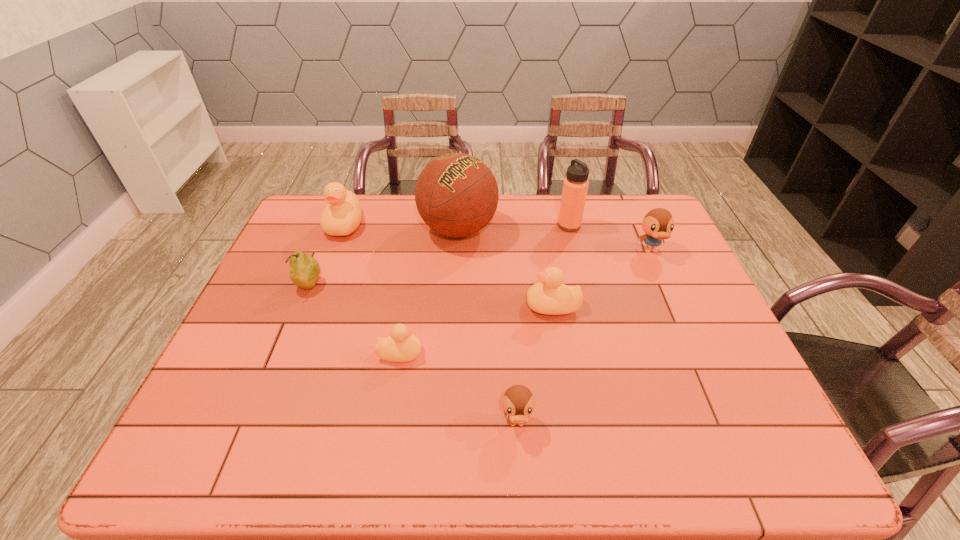
Where is `basketball`? basketball is located at coordinates (456, 194).

Find the location of `orange thermos bottle`. orange thermos bottle is located at coordinates (575, 186).

Where is `the leftmost duck`? This screenshot has height=540, width=960. the leftmost duck is located at coordinates (342, 216).

This screenshot has width=960, height=540. Identify the location of the farthest yellow duck. (342, 216).

Find the location of a particular element. The width and height of the screenshot is (960, 540). the farther blue duck is located at coordinates (658, 224).

Where is `the bigger blue duck`? Image resolution: width=960 pixels, height=540 pixels. the bigger blue duck is located at coordinates 658,224.

Locate an element on the screen. This screenshot has height=540, width=960. the second farthest yellow duck is located at coordinates [x=549, y=296].

Image resolution: width=960 pixels, height=540 pixels. I want to click on the third nearest duck, so click(x=549, y=296).

This screenshot has height=540, width=960. I want to click on pear, so click(304, 272).

You are a GUI agent. You are given a task and a screenshot of the screen. Output one action in this format:
    pyautogui.click(x=<x>, y=<y>)
    Task: Click on the nearer blue duck
    
    Given the screenshot: What is the action you would take?
    pyautogui.click(x=518, y=402)